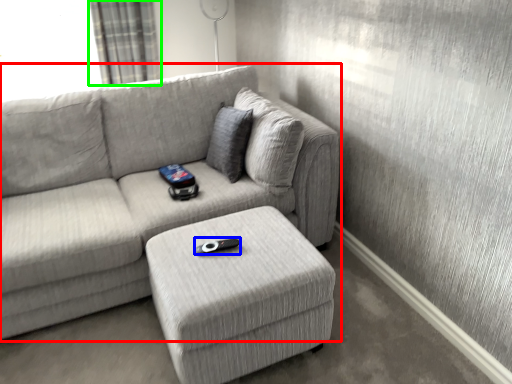
Question: Considering the real-world distances, which object is farthest from studio couch (highlighted by a red box)? remote (highlighted by a blue box) or curtain (highlighted by a green box)?

Choices:
 (A) remote
 (B) curtain

Answer: (B)